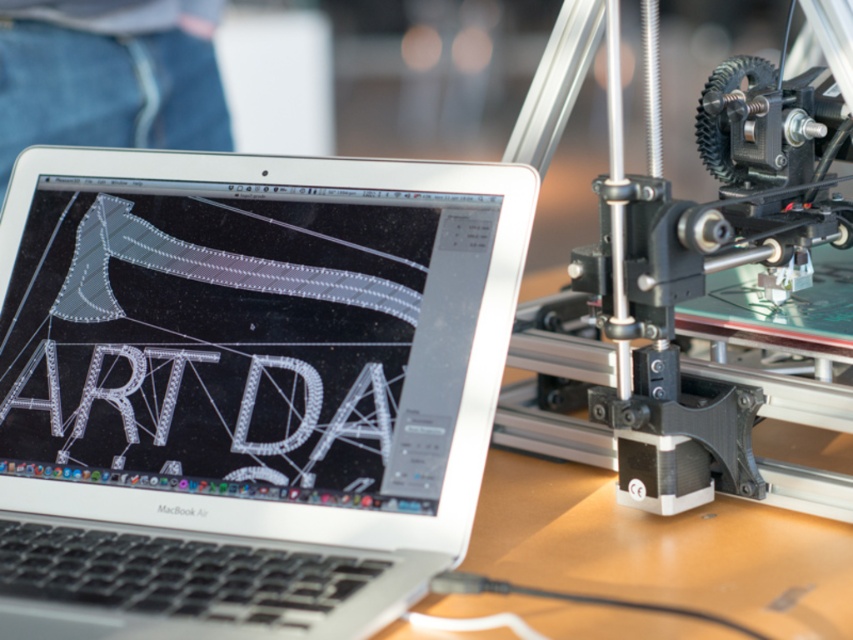
Does point (444, 522) come closer to viewer compared to point (567, 296)?

That is True.

Find the location of `silver/black laptop at center`. silver/black laptop at center is located at coordinates (244, 387).

Does point (212, 177) come farther from viewer compared to point (608, 227)?

Yes, it is behind point (608, 227).

What are the coordinates of `silver/black laptop at center` in the screenshot? It's located at (244, 387).

Is silver/black laptop at center to the left of white metallic letters at center from the viewer's perspective?

Yes, silver/black laptop at center is to the left of white metallic letters at center.

Who is taller, silver/black laptop at center or white metallic letters at center?

Standing taller between the two is silver/black laptop at center.

Who is more forward, (509,184) or (419,445)?

Positioned in front is point (419,445).

Find the location of a particular element. silver/black laptop at center is located at coordinates coord(244,387).

Is black matte 3d printer head at right thinner than white metallic letters at center?

Yes.

I want to click on black matte 3d printer head at right, so click(703, 294).